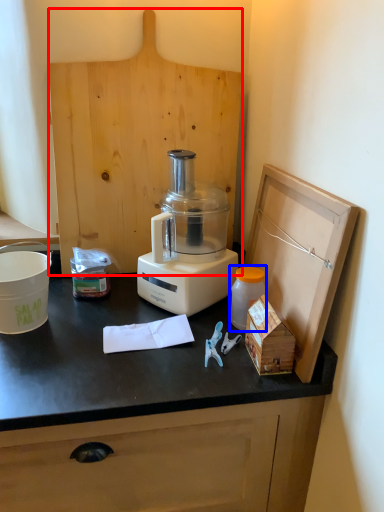
Question: Which object appears closest to the camera in this image, wood (highlighted by a red box) or bottle (highlighted by a blue box)?

Choices:
 (A) wood
 (B) bottle

Answer: (B)